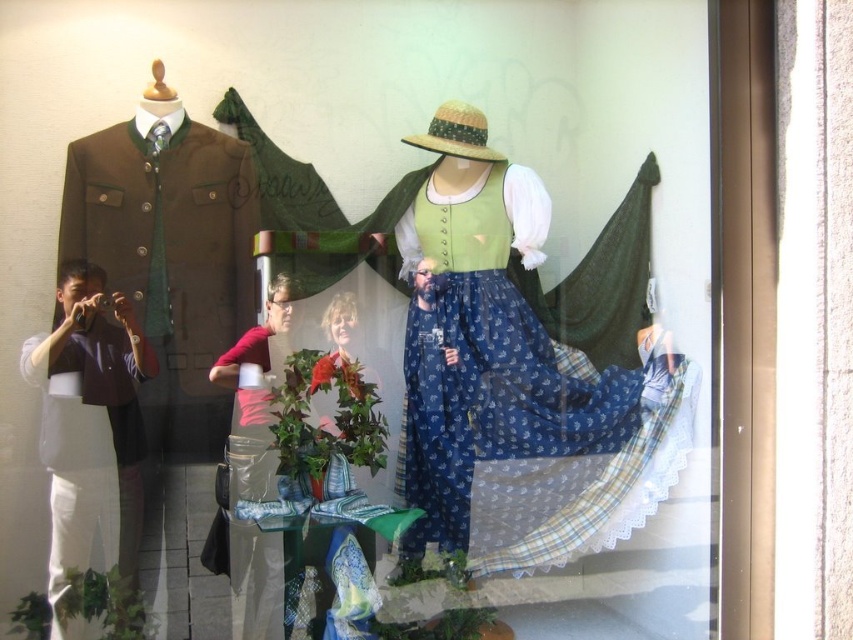
You are a tailor who needs to determine which item requires more fabric for alterations. Based on the display window scene, which object between the matte brown jacket at left and the pink fabric at center would need more fabric due to its size?

The matte brown jacket at left requires more fabric for alterations because it has a larger size compared to the pink fabric at center.

You are a tailor measuring the distance between the matte brown jacket at left and the strawtexturehat at center for a display. The minimum required spacing between items for safety is 24 inches. Is the current distance sufficient?

The matte brown jacket at left and strawtexturehat at center are 25.69 inches apart, which exceeds the 24 inch requirement, so the spacing is sufficient.

Based on the scene description, where is the matte brown jacket at left located in the display window?

The matte brown jacket at left is located at point 0.405 on the x axis and 0.200 on the y axis in the display window.